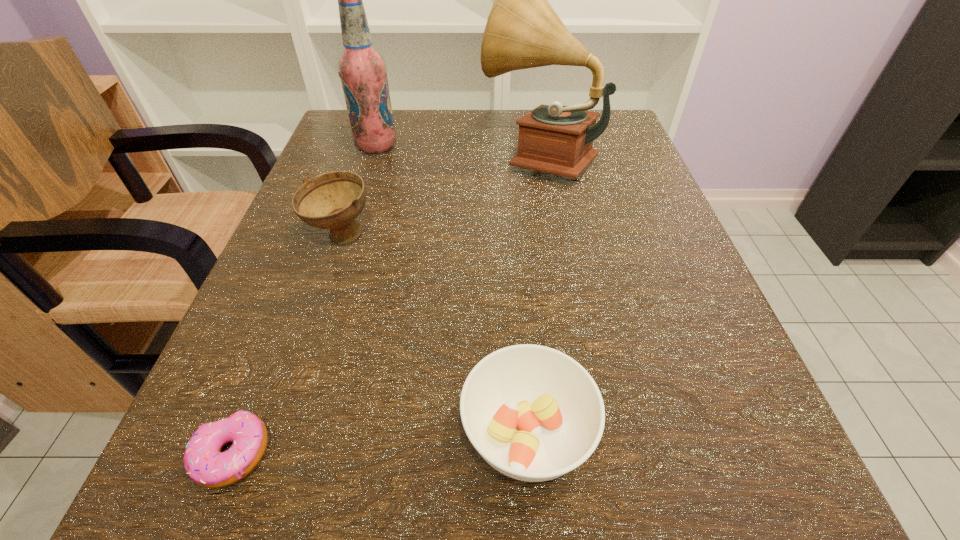
Identify the location of vacant space at the near right corner. (686, 538).

The image size is (960, 540). Identify the location of unoccupied area between the third farthest object and the phonograph record. (440, 196).

You are a GUI agent. You are given a task and a screenshot of the screen. Output one action in this format:
    pyautogui.click(x=<x>, y=<y>)
    Task: Click on the vacant space that is in between the doughnut and the alcohol
    This screenshot has height=540, width=960.
    Given the screenshot: What is the action you would take?
    tap(304, 300)

Find the location of a particular element. This screenshot has height=540, width=960. vacant point located between the phonograph record and the third nearest object is located at coordinates (440, 196).

Where is `unoccupied position between the phonograph record and the doughnut`? This screenshot has height=540, width=960. unoccupied position between the phonograph record and the doughnut is located at coordinates (386, 305).

The height and width of the screenshot is (540, 960). In order to click on free space between the shortest object and the phonograph record in this screenshot , I will do `click(386, 305)`.

Where is `vacant area that lies between the doughnut and the alcohol`? The width and height of the screenshot is (960, 540). vacant area that lies between the doughnut and the alcohol is located at coordinates (304, 300).

Locate an element on the screen. This screenshot has width=960, height=540. vacant point located between the shortest object and the nearer soup bowl is located at coordinates (380, 444).

This screenshot has width=960, height=540. Find the location of `free space between the phonograph record and the shortest object`. free space between the phonograph record and the shortest object is located at coordinates (386, 305).

This screenshot has height=540, width=960. Identify the location of object that stands as the third closest to the alcohol. (533, 413).